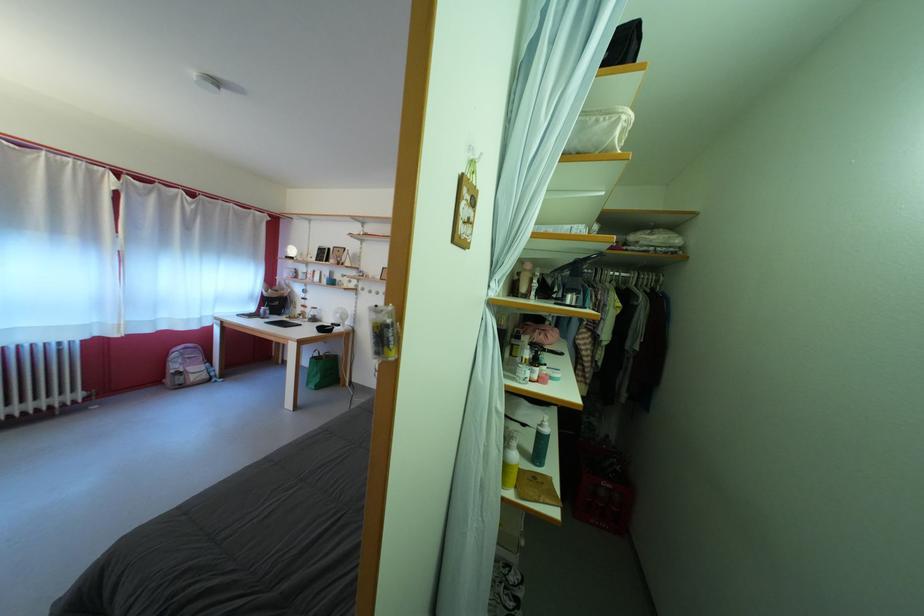
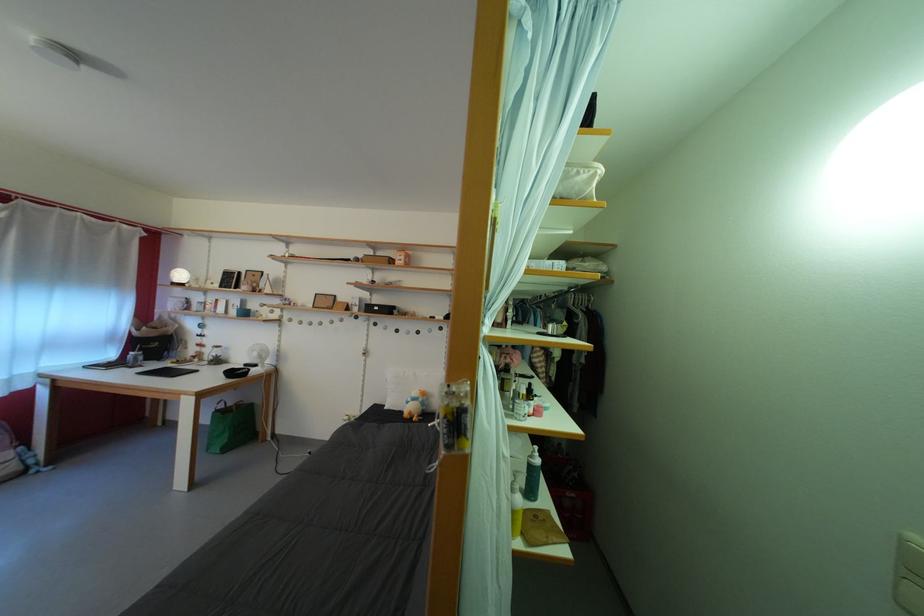
The images are taken continuously from a first-person perspective. In which direction are you moving?

The cameraman moved toward left, forward.